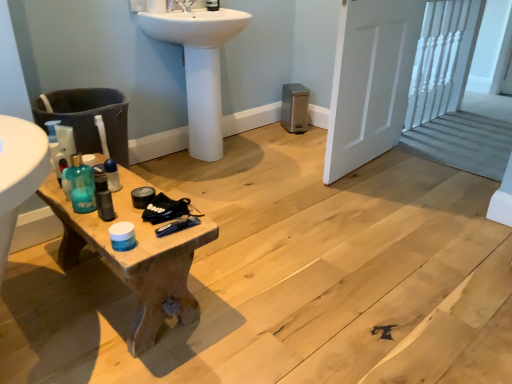
Image resolution: width=512 pixels, height=384 pixels. Identify the location of empty space that is ontop of woodenwoodentable at left. pyautogui.click(x=127, y=201).